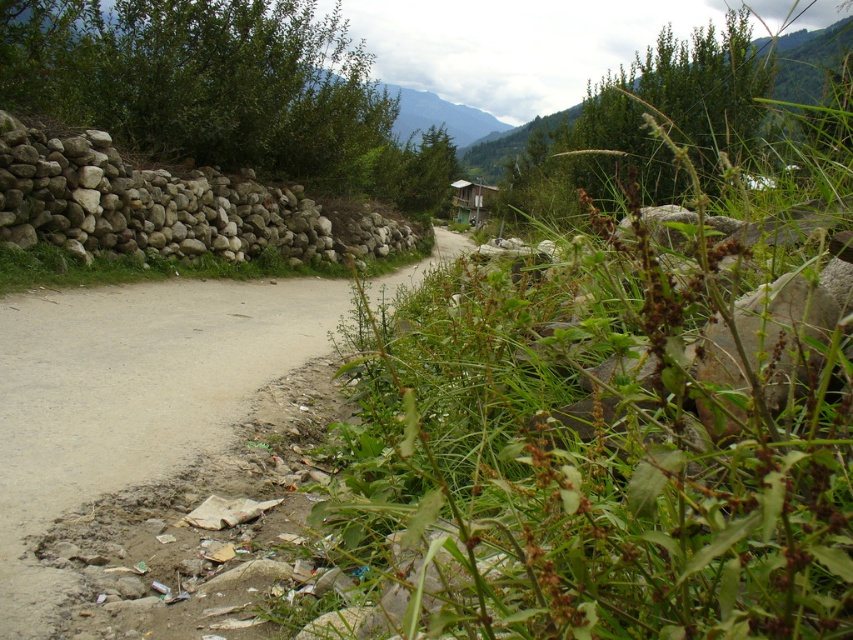
Question: Which point appears farthest from the camera in this image?

Choices:
 (A) (432, 100)
 (B) (482, 182)

Answer: (B)

Question: Is white rock wall at left closer to camera compared to wooden hut at center?

Choices:
 (A) no
 (B) yes

Answer: (B)

Question: Is brown dirt road at left to the left of green textured mountain at upper center from the viewer's perspective?

Choices:
 (A) no
 (B) yes

Answer: (B)

Question: Which object is positioned closest to the white rock wall at left?

Choices:
 (A) brown dirt road at left
 (B) green textured mountain at upper center

Answer: (A)

Question: Is green textured mountain at upper center to the left of wooden hut at center from the viewer's perspective?

Choices:
 (A) no
 (B) yes

Answer: (B)

Question: Which of the following is the closest to the observer?

Choices:
 (A) white rock wall at left
 (B) brown dirt road at left

Answer: (B)